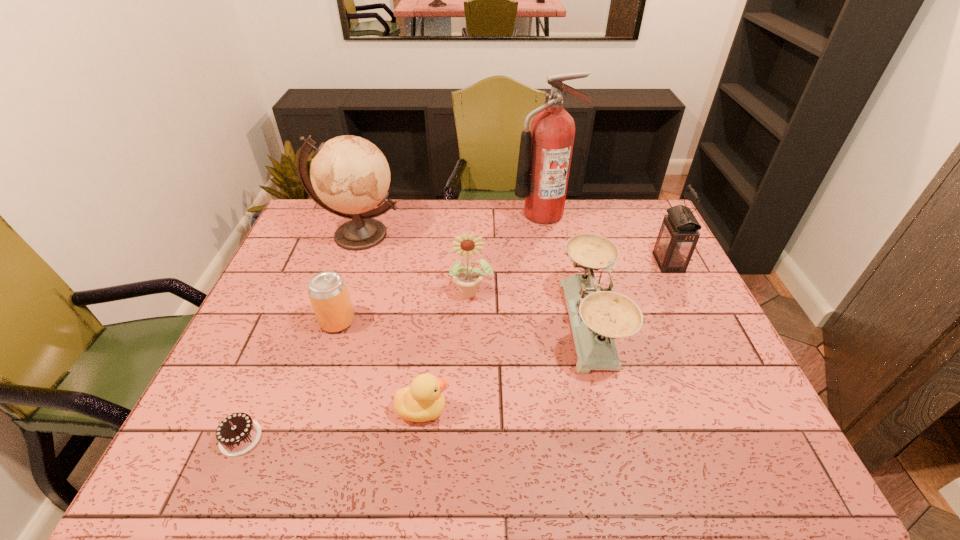
Image resolution: width=960 pixels, height=540 pixels. Identify the location of the tallest object. (545, 153).

This screenshot has width=960, height=540. I want to click on the seventh shortest object, so click(x=350, y=175).

At what (x,y) coordinates should I click in order to perform the action: click on lantern. Please return your answer as a coordinate pair (x, y). The width and height of the screenshot is (960, 540). Looking at the image, I should click on (678, 236).

The image size is (960, 540). I want to click on sunflower, so click(x=467, y=278).

Locate an element on the screen. scale is located at coordinates (598, 315).

The width and height of the screenshot is (960, 540). In order to click on the third shortest object in this screenshot , I will do `click(328, 293)`.

Identify the location of the second shortest object. (423, 401).

Identify the location of the shortest object. (237, 434).

Locate an element on the screen. free space located on the front of the fire extinguisher near the operation label is located at coordinates (561, 307).

You are a GUI agent. You are given a task and a screenshot of the screen. Output one action in this format:
    pyautogui.click(x=<x>, y=<y>)
    Task: Click on the vacant space located on the front-facing side of the second tallest object
    
    Given the screenshot: What is the action you would take?
    pyautogui.click(x=348, y=267)